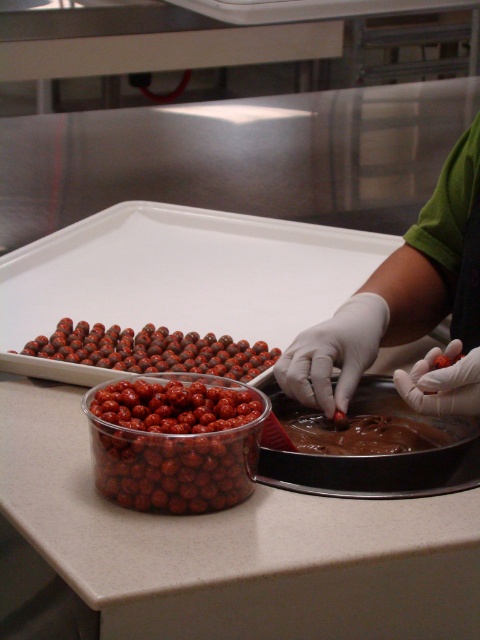
Is the position of glossy red chocolate at center less distant than that of chocolate smooth at center?

No, it is not.

In the scene shown: Who is shorter, glossy red chocolate at center or chocolate smooth at center?

With less height is chocolate smooth at center.

Who is more forward, (x=113, y=330) or (x=440, y=442)?

Point (x=440, y=442) is in front.

Where is `glossy red chocolate at center`? The height and width of the screenshot is (640, 480). glossy red chocolate at center is located at coordinates tap(152, 349).

Who is more distant from viewer, (x=214, y=484) or (x=195, y=355)?

The point (x=195, y=355) is behind.

Between shiny red chocolate at center and glossy red chocolate at center, which one has more height?

shiny red chocolate at center

Find the location of `shiny red chocolate at center`. shiny red chocolate at center is located at coordinates (x=175, y=458).

Where is `shiny red chocolate at center`? The width and height of the screenshot is (480, 640). shiny red chocolate at center is located at coordinates (175, 458).

Is shiny red chocolate at center to the left of chocolate smooth at center from the viewer's perspective?

Correct, you'll find shiny red chocolate at center to the left of chocolate smooth at center.

What do you see at coordinates (175, 458) in the screenshot?
I see `shiny red chocolate at center` at bounding box center [175, 458].

Is point (205, 458) more distant than point (349, 451)?

No, it is not.

In order to click on shiny red chocolate at center in this screenshot , I will do `click(175, 458)`.